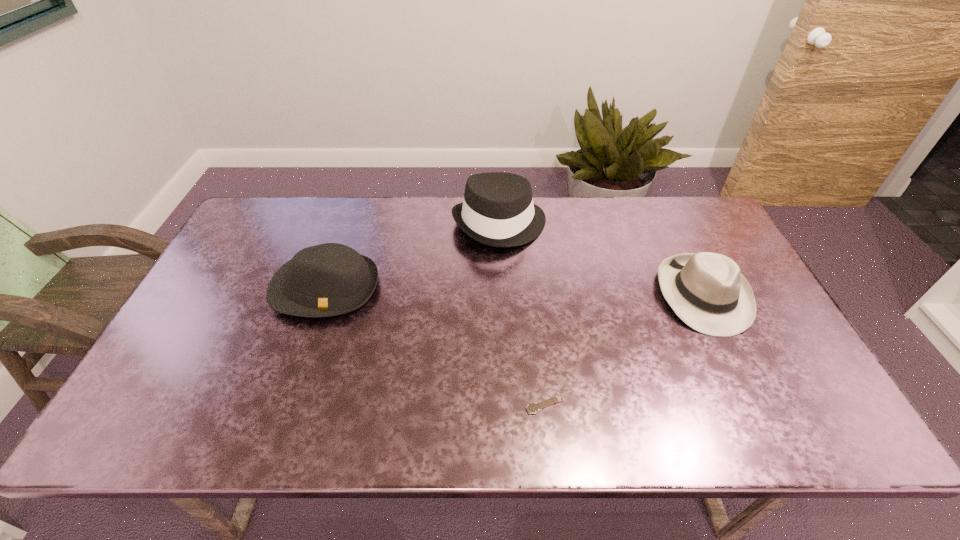
Identify which object is the third nearest to the rightmost fedora. Please provide its 2D coordinates. Your answer should be formatted as a tuple, i.e. [(x, y)], where the tuple contains the x and y coordinates of a point satisfying the conditions above.

[(330, 279)]

The height and width of the screenshot is (540, 960). Identify the location of fedora identified as the second closest to the farthest object. (707, 291).

Identify which fedora is the nearest to the rightmost fedora. Please provide its 2D coordinates. Your answer should be formatted as a tuple, i.e. [(x, y)], where the tuple contains the x and y coordinates of a point satisfying the conditions above.

[(497, 210)]

You are a GUI agent. You are given a task and a screenshot of the screen. Output one action in this format:
    pyautogui.click(x=<x>, y=<y>)
    Task: Click on the free spot that satisfies the following two spatial constraints: 1. on the front-facing side of the leftmost fedora; 2. on the left side of the watch
    
    Given the screenshot: What is the action you would take?
    pyautogui.click(x=286, y=404)

Locate an element on the screen. vacant space that satisfies the following two spatial constraints: 1. on the front-facing side of the leftmost fedora; 2. on the left side of the nearest object is located at coordinates (286, 404).